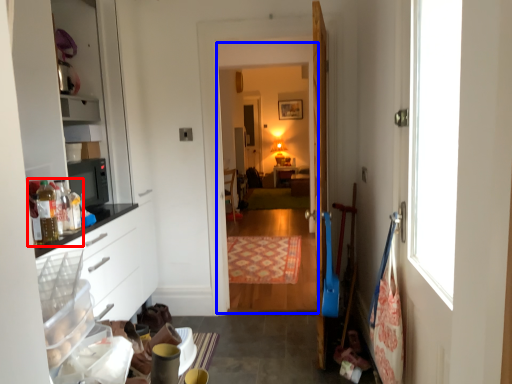
Question: Which object appears farthest to the camera in this image, food (highlighted by a red box) or corridor (highlighted by a blue box)?

Choices:
 (A) food
 (B) corridor

Answer: (B)